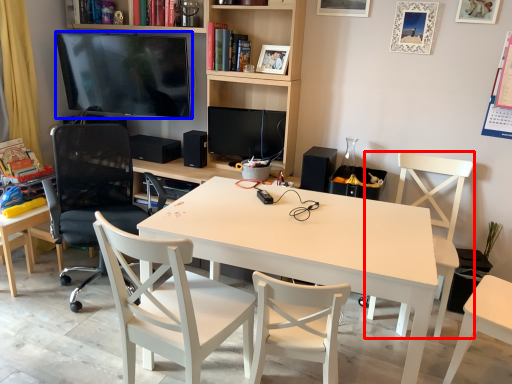
Question: Which object is further to the camera taking this photo, chair (highlighted by a red box) or television (highlighted by a blue box)?

Choices:
 (A) chair
 (B) television

Answer: (B)